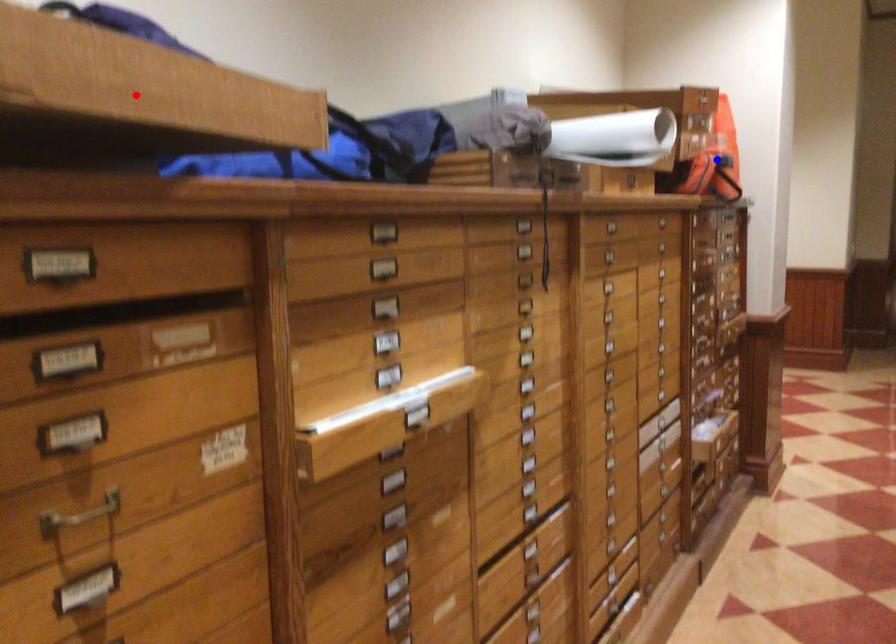
Question: Which of the two points in the image is closer to the camera?

Choices:
 (A) Blue point is closer.
 (B) Red point is closer.

Answer: (B)